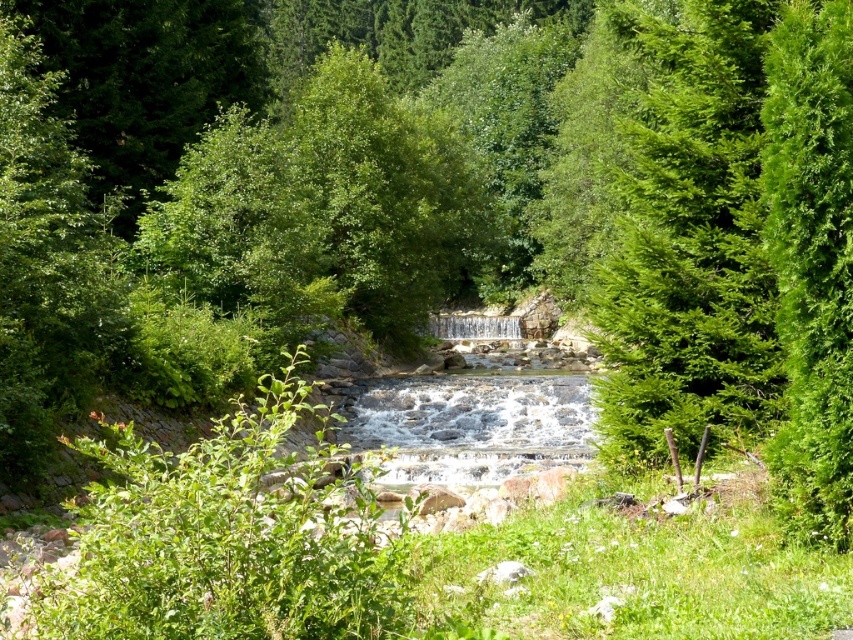
Who is positioned more to the left, green leafy tree at right or green fluffy tree at right?

green fluffy tree at right

Which of these two, green leafy tree at right or green fluffy tree at right, stands shorter?

green fluffy tree at right is shorter.

Does point (747, 124) come in front of point (793, 512)?

That is False.

Find the location of a particular element. The image size is (853, 640). green leafy tree at right is located at coordinates (688, 237).